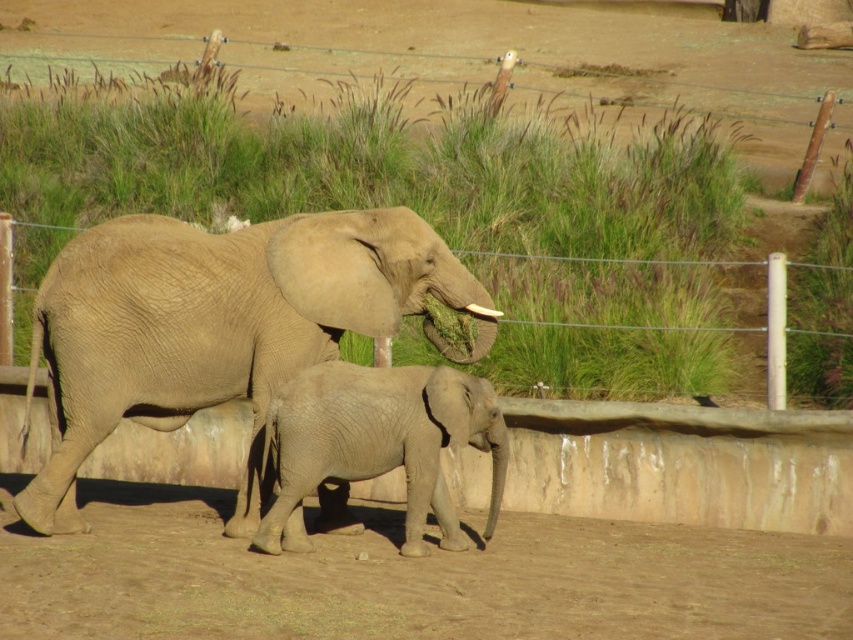
Question: Can you confirm if gray textured elephant at center is positioned below wire mesh fence at center?

Choices:
 (A) yes
 (B) no

Answer: (A)

Question: Is gray textured elephant at center thinner than gray matte elephant at center?

Choices:
 (A) no
 (B) yes

Answer: (A)

Question: Which object is closer to the camera taking this photo?

Choices:
 (A) gray textured elephant at center
 (B) wire mesh fence at center

Answer: (A)

Question: Which object is farther from the camera taking this photo?

Choices:
 (A) wire mesh fence at center
 (B) gray textured elephant at center

Answer: (A)

Question: Which point is farther to the camera?

Choices:
 (A) gray matte elephant at center
 (B) gray textured elephant at center
 (C) wire mesh fence at center

Answer: (C)

Question: Does gray matte elephant at center have a lesser width compared to wire mesh fence at center?

Choices:
 (A) yes
 (B) no

Answer: (B)